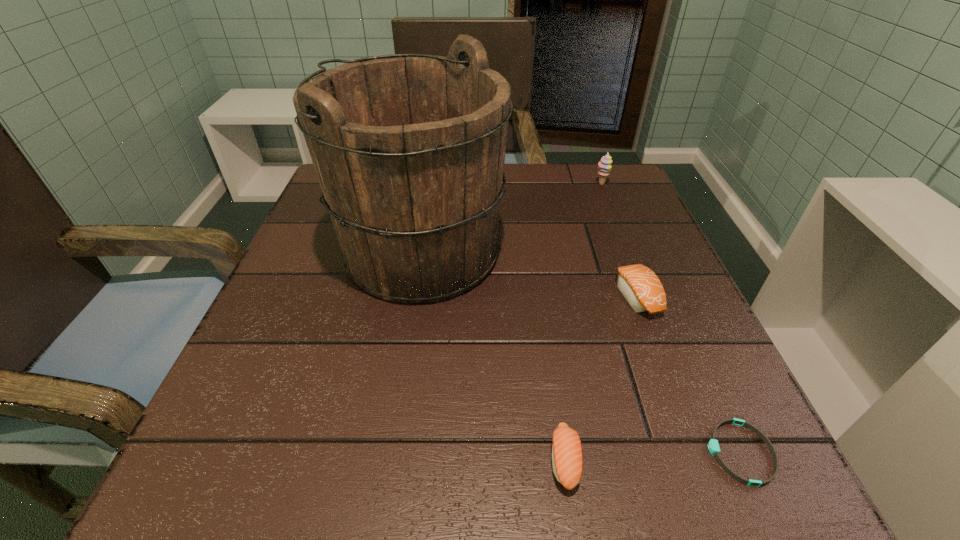
Identify which object is the third closest to the bucket. Please provide its 2D coordinates. Your answer should be formatted as a tuple, i.e. [(x, y)], where the tuple contains the x and y coordinates of a point satisfying the conditions above.

[(604, 165)]

Identify which object is the nearest to the sherbert. Please provide its 2D coordinates. Your answer should be formatted as a tuple, i.e. [(x, y)], where the tuple contains the x and y coordinates of a point satisfying the conditions above.

[(409, 149)]